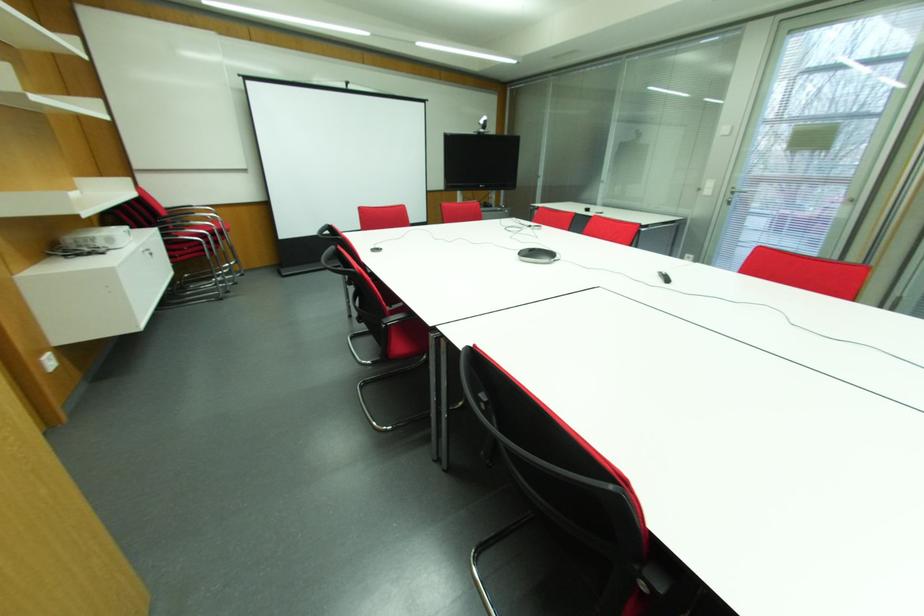
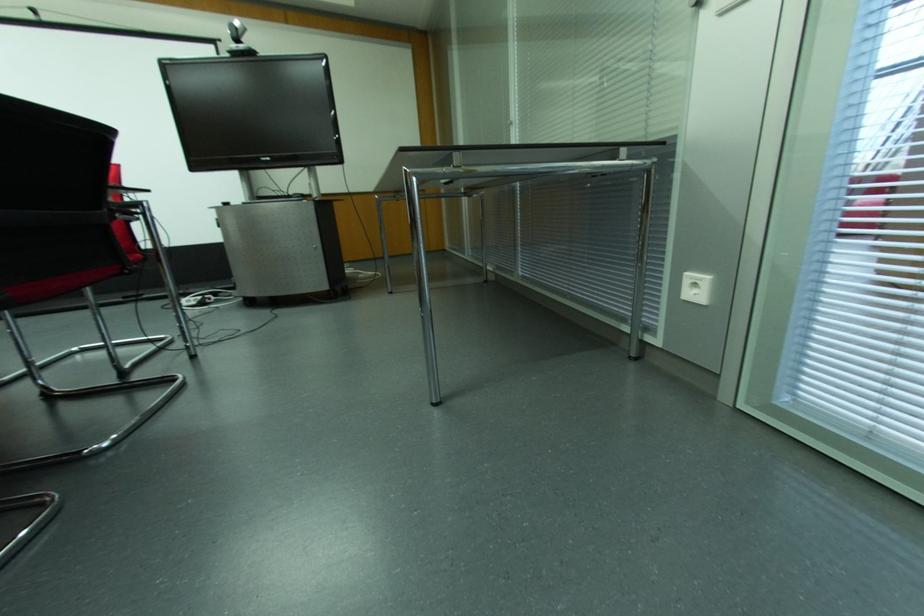
What movement of the cameraman would produce the second image?

The cameraman moved toward right, forward.